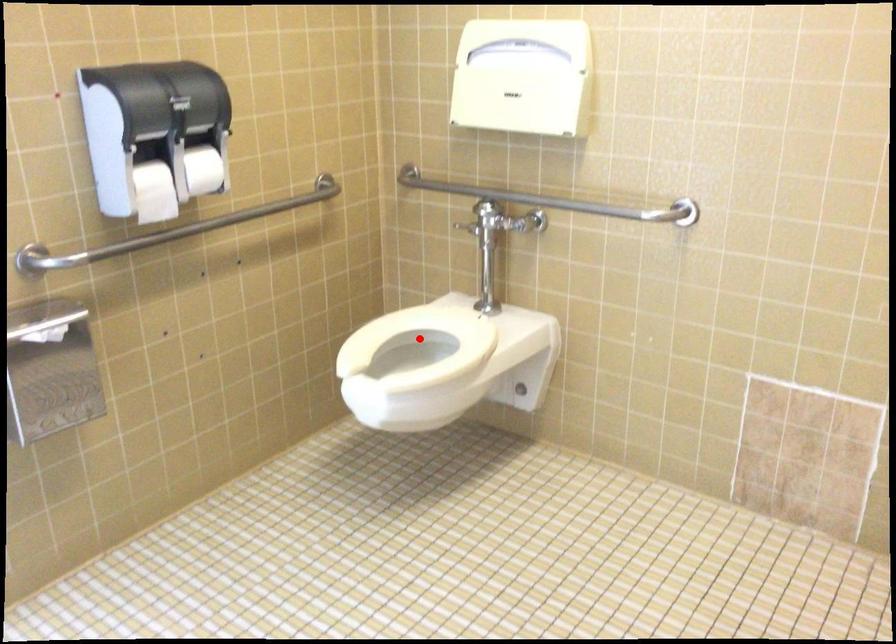
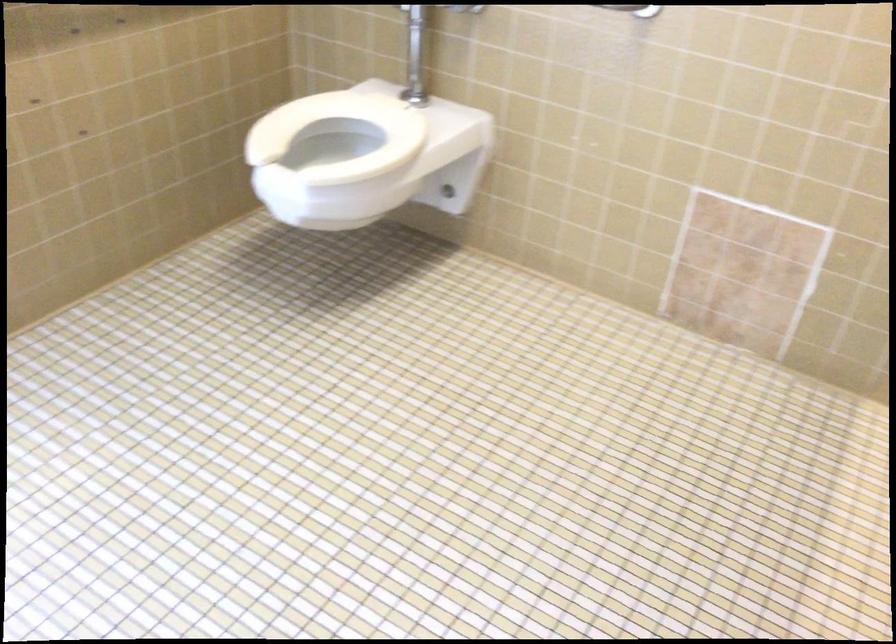
Question: I am providing you with two images of the same scene from different viewpoints. A red point is marked on the first image. At the location where the point appears in image 1, is it still visible in image 2?

Choices:
 (A) Yes
 (B) No

Answer: (A)